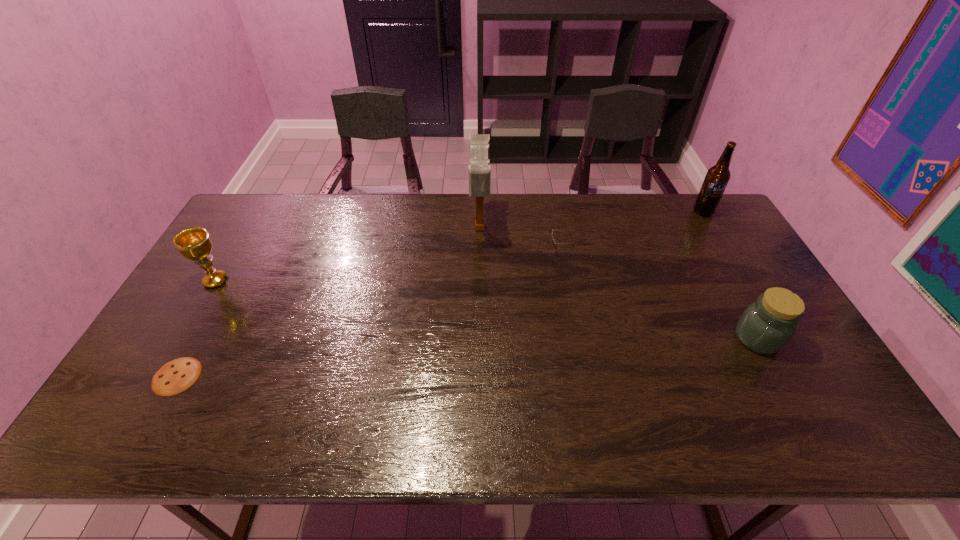
The image size is (960, 540). What are the coordinates of `cookie positioned at the left edge` in the screenshot? It's located at pos(176,376).

You are a GUI agent. You are given a task and a screenshot of the screen. Output one action in this format:
    pyautogui.click(x=<x>, y=<y>)
    Task: Click on the beer bottle that is at the right edge
    The image size is (960, 540).
    Given the screenshot: What is the action you would take?
    pyautogui.click(x=717, y=177)

This screenshot has width=960, height=540. In order to click on jar that is at the right edge in this screenshot , I will do `click(766, 326)`.

At what (x,y) coordinates should I click in order to perform the action: click on object present at the far right corner. Please return your answer as a coordinate pair (x, y). Looking at the image, I should click on (717, 177).

Identify the location of vacant space at the far edge of the desktop. point(647,206).

I want to click on vacant space at the near edge, so click(299, 424).

Locate an element on the screen. The height and width of the screenshot is (540, 960). vacant space at the right edge of the desktop is located at coordinates (736, 302).

You are a GUI agent. You are given a task and a screenshot of the screen. Output one action in this format:
    pyautogui.click(x=<x>, y=<y>)
    Task: Click on the free space at the near right corner of the desktop
    The image size is (960, 540).
    Given the screenshot: What is the action you would take?
    pyautogui.click(x=845, y=422)

You are a GUI agent. You are given a task and a screenshot of the screen. Output one action in this format:
    pyautogui.click(x=<x>, y=<y>)
    Task: Click on the unoccupied area between the fourth object from left to right and the beer bottle
    Image resolution: width=960 pixels, height=540 pixels.
    Given the screenshot: What is the action you would take?
    pyautogui.click(x=632, y=231)

Locate an element on the screen. free spot between the fourth farthest object and the beer bottle is located at coordinates (459, 246).